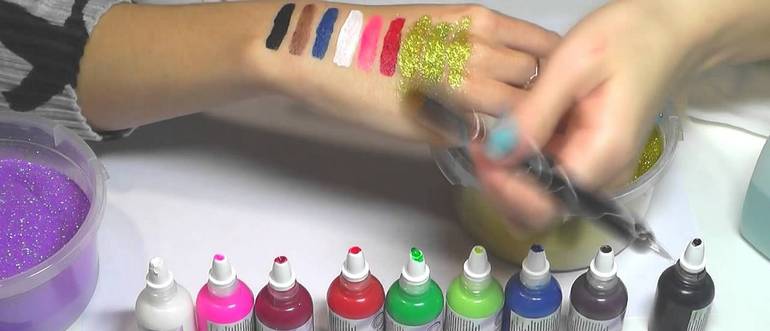
Identify the location of blue paint. (323, 39), (537, 289).